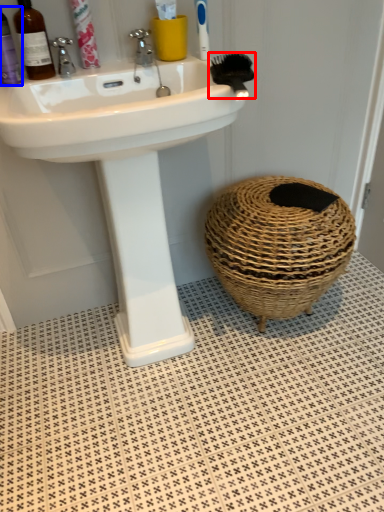
Question: Which object appears farthest to the camera in this image, brush (highlighted by a red box) or mouthwash (highlighted by a blue box)?

Choices:
 (A) brush
 (B) mouthwash

Answer: (B)